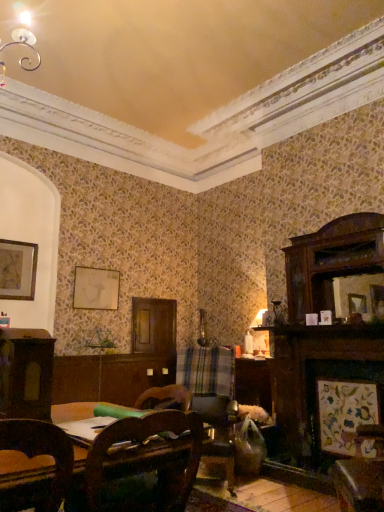
The width and height of the screenshot is (384, 512). I want to click on wooden chair at center, so click(x=144, y=464).

The width and height of the screenshot is (384, 512). Identify the location of dark wood cabinet at left. point(26,373).

Identify the location of matte white picture frame at upper center, the third picture frame viewed from the right. pos(96,288).

The height and width of the screenshot is (512, 384). Identify the location of wooden framed artwork at upper left, the 4th picture frame when ordered from right to left. (18, 270).

Identify the location of wooden chair at center. The width and height of the screenshot is (384, 512). (144, 464).

Considering the relative sizes of dark wood cabinet at left and wooden picture frame at right, placed as the first picture frame when sorted from right to left, in the image provided, is dark wood cabinet at left taller than wooden picture frame at right, placed as the first picture frame when sorted from right to left,?

Indeed, dark wood cabinet at left has a greater height compared to wooden picture frame at right, placed as the first picture frame when sorted from right to left.

Between dark wood cabinet at left and wooden picture frame at right, which is counted as the second picture frame, starting from the front, which one has smaller size?

With smaller size is wooden picture frame at right, which is counted as the second picture frame, starting from the front.

Does dark wood cabinet at left have a greater width compared to wooden picture frame at right, which appears as the third picture frame when viewed from the top?

Indeed, dark wood cabinet at left has a greater width compared to wooden picture frame at right, which appears as the third picture frame when viewed from the top.

Is dark wood cabinet at left facing towards wooden picture frame at right, placed as the first picture frame when sorted from right to left?

No, dark wood cabinet at left is not aimed at wooden picture frame at right, placed as the first picture frame when sorted from right to left.

Considering the sizes of objects plaid fabric swivel chair at center and dark wood cabinet at left in the image provided, who is thinner, plaid fabric swivel chair at center or dark wood cabinet at left?

dark wood cabinet at left.

Is plaid fabric swivel chair at center located outside dark wood cabinet at left?

Indeed, plaid fabric swivel chair at center is completely outside dark wood cabinet at left.

Which object is positioned more to the right, plaid fabric swivel chair at center or dark wood cabinet at left?

plaid fabric swivel chair at center.

Is plaid fabric swivel chair at center aimed at dark wood cabinet at left?

Yes, plaid fabric swivel chair at center is facing dark wood cabinet at left.

Consider the image. Which of these two, dark wood cabinet at left or wooden framed artwork at upper left, the first picture frame positioned from the top, is thinner?

wooden framed artwork at upper left, the first picture frame positioned from the top, is thinner.

Who is smaller, dark wood cabinet at left or wooden framed artwork at upper left, which is the second picture frame in back-to-front order?

With smaller size is wooden framed artwork at upper left, which is the second picture frame in back-to-front order.

Considering the positions of points (12, 347) and (12, 286), is point (12, 347) closer to camera compared to point (12, 286)?

Yes.

From a real-world perspective, is wooden framed artwork at upper left, the first picture frame positioned from the top, under wooden picture frame at right, which is counted as the second picture frame, starting from the front?

No, from a real-world perspective, wooden framed artwork at upper left, the first picture frame positioned from the top, is not beneath wooden picture frame at right, which is counted as the second picture frame, starting from the front.

Which object is more forward, wooden framed artwork at upper left, which appears as the 3th picture frame when viewed from the front, or wooden picture frame at right, the 2th picture frame ordered from the bottom?

wooden picture frame at right, the 2th picture frame ordered from the bottom.

In terms of height, does wooden framed artwork at upper left, positioned as the first picture frame in left-to-right order, look taller or shorter compared to wooden picture frame at right, which is counted as the second picture frame, starting from the front?

In the image, wooden framed artwork at upper left, positioned as the first picture frame in left-to-right order, appears to be taller than wooden picture frame at right, which is counted as the second picture frame, starting from the front.

Which is more to the left, wooden framed artwork at upper left, the first picture frame positioned from the top, or wooden picture frame at right, the 4th picture frame from the left?

wooden framed artwork at upper left, the first picture frame positioned from the top, is more to the left.

Which point is more forward, (9, 251) or (122, 454)?

Positioned in front is point (122, 454).

Identify the location of picture frame that is the 3rd object located behind the wooden chair at center. (18, 270).

Between wooden framed artwork at upper left, which appears as the 3th picture frame when viewed from the front, and wooden chair at center, which one appears on the right side from the viewer's perspective?

wooden chair at center.

Would you say wooden framed artwork at upper left, which is the second picture frame in back-to-front order, is inside or outside wooden chair at center?

wooden framed artwork at upper left, which is the second picture frame in back-to-front order, is spatially situated outside wooden chair at center.

From the image's perspective, does matte white picture frame at upper center, the 1th picture frame positioned from the back, appear higher than wooden framed artwork at lower right, arranged as the 4th picture frame when viewed from the top?

Yes.

Consider the image. Considering the sizes of objects matte white picture frame at upper center, which is the fourth picture frame from front to back, and wooden framed artwork at lower right, the 2th picture frame from the right, in the image provided, who is smaller, matte white picture frame at upper center, which is the fourth picture frame from front to back, or wooden framed artwork at lower right, the 2th picture frame from the right,?

Smaller between the two is matte white picture frame at upper center, which is the fourth picture frame from front to back.

Is matte white picture frame at upper center, which is the fourth picture frame from front to back, thinner than wooden framed artwork at lower right, the 1th picture frame positioned from the front?

Yes, matte white picture frame at upper center, which is the fourth picture frame from front to back, is thinner than wooden framed artwork at lower right, the 1th picture frame positioned from the front.

Does matte white picture frame at upper center, acting as the third picture frame starting from the bottom, turn towards wooden framed artwork at lower right, arranged as the 4th picture frame when viewed from the top?

No, matte white picture frame at upper center, acting as the third picture frame starting from the bottom, is not oriented towards wooden framed artwork at lower right, arranged as the 4th picture frame when viewed from the top.

Find the location of a particular element. This screenshot has width=384, height=512. the 2nd picture frame positioned above the wooden chair at center (from a real-world perspective) is located at coordinates (96, 288).

From the image's perspective, is wooden chair at center beneath matte white picture frame at upper center, the third picture frame viewed from the right?

Yes.

Considering the positions of point (143, 495) and point (112, 279), is point (143, 495) closer or farther from the camera than point (112, 279)?

Clearly, point (143, 495) is closer to the camera than point (112, 279).

Is wooden chair at center not inside matte white picture frame at upper center, the 1th picture frame positioned from the back?

Yes.

Where is `the 2nd picture frame counting from the right side of the dark wood cabinet at left`? The width and height of the screenshot is (384, 512). the 2nd picture frame counting from the right side of the dark wood cabinet at left is located at coordinates (377, 301).

Identify the location of cabinetry in front of the plaid fabric swivel chair at center. Image resolution: width=384 pixels, height=512 pixels. click(26, 373).

Estimate the real-world distances between objects in this image. Which object is further from wooden chair at center, wooden picture frame at right, which appears as the third picture frame when viewed from the top, or dark wood cabinet at left?

wooden picture frame at right, which appears as the third picture frame when viewed from the top, is further to wooden chair at center.

Based on their spatial positions, is wooden framed artwork at lower right, which ranks as the 4th picture frame in back-to-front order, or wooden chair at center further from plaid fabric swivel chair at center?

Among the two, wooden chair at center is located further to plaid fabric swivel chair at center.

Based on their spatial positions, is dark wood cabinet at left or wooden picture frame at right, the 4th picture frame from the left, closer to wooden framed artwork at lower right, the 2th picture frame from the right?

Among the two, wooden picture frame at right, the 4th picture frame from the left, is located nearer to wooden framed artwork at lower right, the 2th picture frame from the right.

When comparing their distances from wooden picture frame at right, which appears as the third picture frame when viewed from the top, does wooden chair at center or matte white picture frame at upper center, which is counted as the second picture frame, starting from the top, seem further?

Among the two, matte white picture frame at upper center, which is counted as the second picture frame, starting from the top, is located further to wooden picture frame at right, which appears as the third picture frame when viewed from the top.

Consider the image. From the image, which object appears to be nearer to wooden framed artwork at lower right, the 1th picture frame when ordered from bottom to top, dark wood cabinet at left or wooden framed artwork at upper left, which is the second picture frame in back-to-front order?

dark wood cabinet at left is positioned closer to the anchor wooden framed artwork at lower right, the 1th picture frame when ordered from bottom to top.

Based on their spatial positions, is wooden framed artwork at upper left, which appears as the 3th picture frame when viewed from the front, or dark wood cabinet at left closer to matte white picture frame at upper center, which is the fourth picture frame from front to back?

wooden framed artwork at upper left, which appears as the 3th picture frame when viewed from the front.

Which object lies further to the anchor point wooden picture frame at right, the 2th picture frame ordered from the bottom, wooden framed artwork at upper left, which appears as the 3th picture frame when viewed from the front, or wooden chair at center?

wooden framed artwork at upper left, which appears as the 3th picture frame when viewed from the front, is further to wooden picture frame at right, the 2th picture frame ordered from the bottom.

Looking at this image, which object lies nearer to the anchor point dark wood cabinet at left, wooden chair at center or plaid fabric swivel chair at center?

wooden chair at center lies closer to dark wood cabinet at left than the other object.

Locate an element on the screen. This screenshot has width=384, height=512. chair between dark wood cabinet at left and wooden framed artwork at upper left, positioned as the first picture frame in left-to-right order, from front to back is located at coordinates (144, 464).

Locate an element on the screen. chair situated between wooden framed artwork at upper left, which appears as the 3th picture frame when viewed from the front, and wooden framed artwork at lower right, the 1th picture frame positioned from the front, from left to right is located at coordinates (144, 464).

You are a GUI agent. You are given a task and a screenshot of the screen. Output one action in this format:
    pyautogui.click(x=<x>, y=<y>)
    Task: Click on the swivel chair between wooden chair at center and wooden picture frame at right, which is counted as the second picture frame, starting from the front, in the horizontal direction
    
    Given the screenshot: What is the action you would take?
    pyautogui.click(x=208, y=381)

Where is `picture frame between wooden framed artwork at upper left, which appears as the 3th picture frame when viewed from the front, and plaid fabric swivel chair at center from left to right`? The width and height of the screenshot is (384, 512). picture frame between wooden framed artwork at upper left, which appears as the 3th picture frame when viewed from the front, and plaid fabric swivel chair at center from left to right is located at coordinates (96, 288).